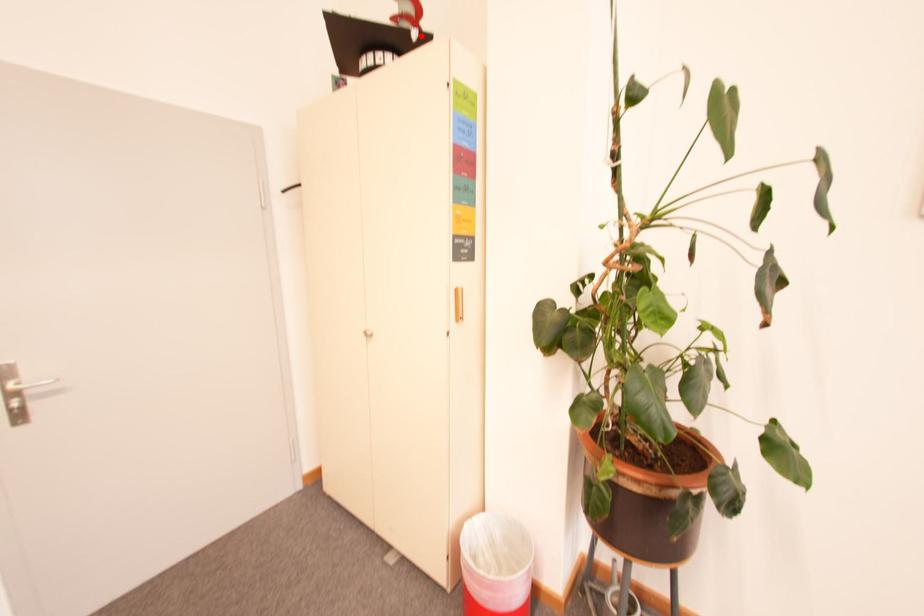
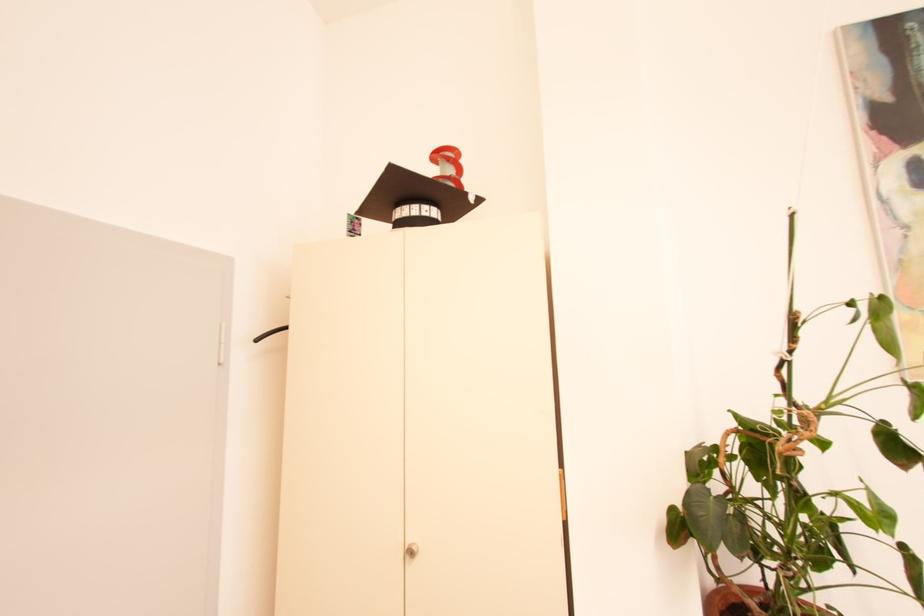
The point at the highlighted location is marked in the first image. Where is the corresponding point in the second image?

(478, 199)